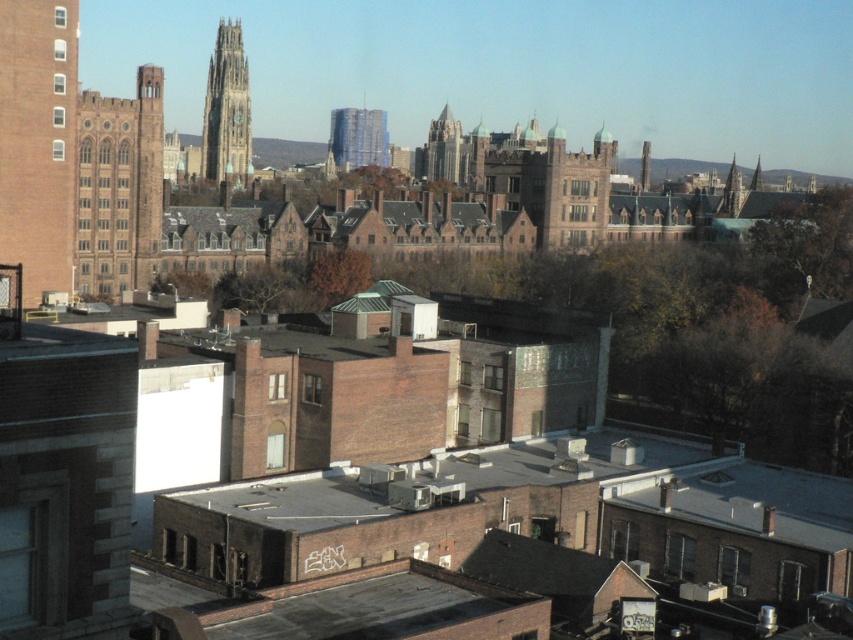
Can you confirm if brown stone tower at left is taller than gold stone tower at upper left?

In fact, brown stone tower at left may be shorter than gold stone tower at upper left.

Is brown stone tower at left above gold stone tower at upper left?

No.

Between point (91, 282) and point (216, 156), which one is positioned behind?

The point (216, 156) is behind.

I want to click on brown stone tower at left, so click(x=119, y=186).

Is brick tower at left below dark gray stone tower at upper center?

Indeed, brick tower at left is positioned under dark gray stone tower at upper center.

Does brick tower at left have a greater height compared to dark gray stone tower at upper center?

Correct, brick tower at left is much taller as dark gray stone tower at upper center.

At what (x,y) coordinates should I click in order to perform the action: click on brick tower at left. Please return your answer as a coordinate pair (x, y). This screenshot has width=853, height=640. Looking at the image, I should click on (38, 141).

The height and width of the screenshot is (640, 853). Identify the location of brick tower at left. (38, 141).

Is brick tower at left bigger than gold stone tower at upper left?

Indeed, brick tower at left has a larger size compared to gold stone tower at upper left.

Is point (49, 147) positioned after point (207, 173)?

No, (49, 147) is in front of (207, 173).

Is point (74, 172) farther from camera compared to point (222, 140)?

No, it is in front of (222, 140).

Find the location of a particular element. This screenshot has width=853, height=640. brick tower at left is located at coordinates (38, 141).